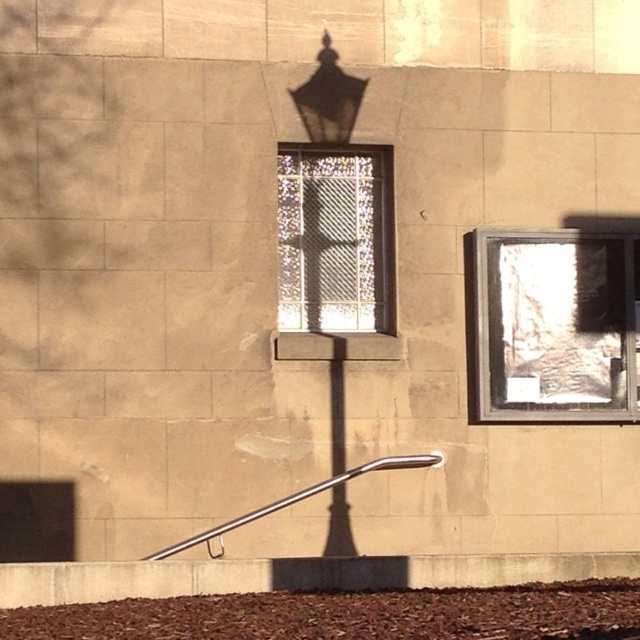
Question: Estimate the real-world distances between objects in this image. Which object is farther from the satin silver rail at lower center?

Choices:
 (A) matte black lamp at upper center
 (B) stained glass window at center
 (C) brown mulch at lower center
 (D) translucent glass window at center right

Answer: (C)

Question: Which of the following is the closest to the observer?

Choices:
 (A) matte black lamp at upper center
 (B) translucent glass window at center right

Answer: (B)

Question: Is translucent glass window at center right above satin silver rail at lower center?

Choices:
 (A) no
 (B) yes

Answer: (B)

Question: Estimate the real-world distances between objects in this image. Which object is closer to the satin silver rail at lower center?

Choices:
 (A) translucent glass window at center right
 (B) stained glass window at center

Answer: (A)

Question: Can you confirm if brown mulch at lower center is positioned above satin silver rail at lower center?

Choices:
 (A) no
 (B) yes

Answer: (A)

Question: Is translucent glass window at center right smaller than satin silver rail at lower center?

Choices:
 (A) no
 (B) yes

Answer: (B)